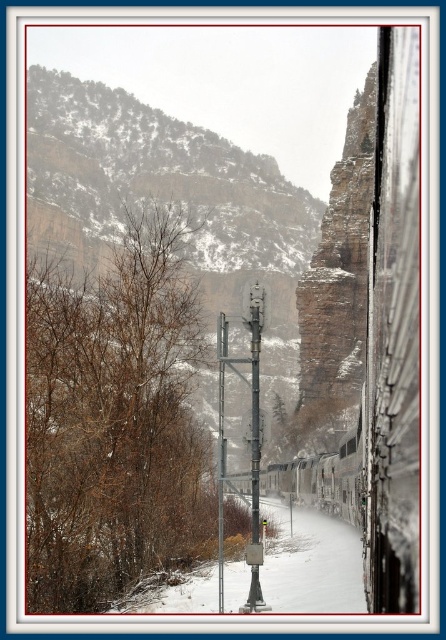
Question: Can you confirm if metal train at right is positioned to the right of metallic gray pole at center?

Choices:
 (A) yes
 (B) no

Answer: (B)

Question: Is brown/drytree at left in front of metallic gray pole at center?

Choices:
 (A) yes
 (B) no

Answer: (B)

Question: Can you confirm if brown/drytree at left is wider than metallic gray pole at center?

Choices:
 (A) no
 (B) yes

Answer: (B)

Question: Which of these objects is positioned farthest from the metal train at right?

Choices:
 (A) brown/drytree at left
 (B) metallic gray pole at center

Answer: (B)

Question: Which object is positioned closest to the metal train at right?

Choices:
 (A) metallic gray pole at center
 (B) brown/drytree at left

Answer: (B)

Question: Which point is farther to the camera?

Choices:
 (A) brown/drytree at left
 (B) metal train at right

Answer: (A)